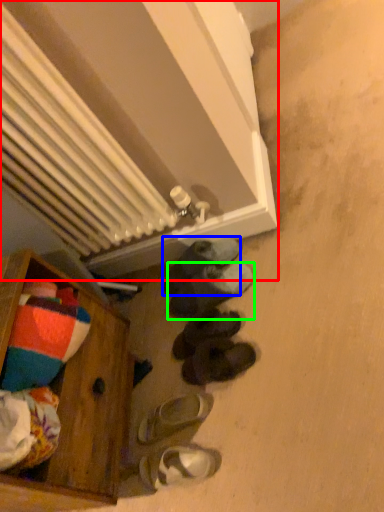
Question: Estimate the real-world distances between objects in this image. Which object is farther from radiator (highlighted by a red box), footwear (highlighted by a blue box) or footwear (highlighted by a green box)?

Choices:
 (A) footwear
 (B) footwear

Answer: (B)